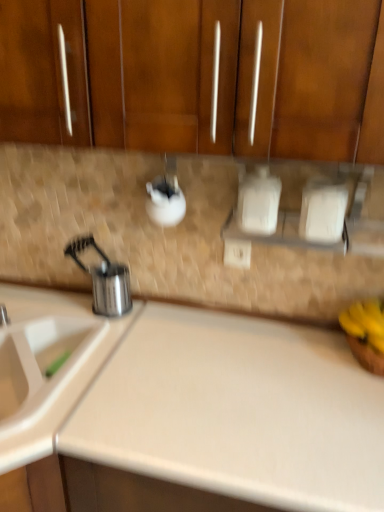
The image size is (384, 512). Find the location of `vacant area that is in front of stainless steel utensil holder at left`. vacant area that is in front of stainless steel utensil holder at left is located at coordinates (101, 336).